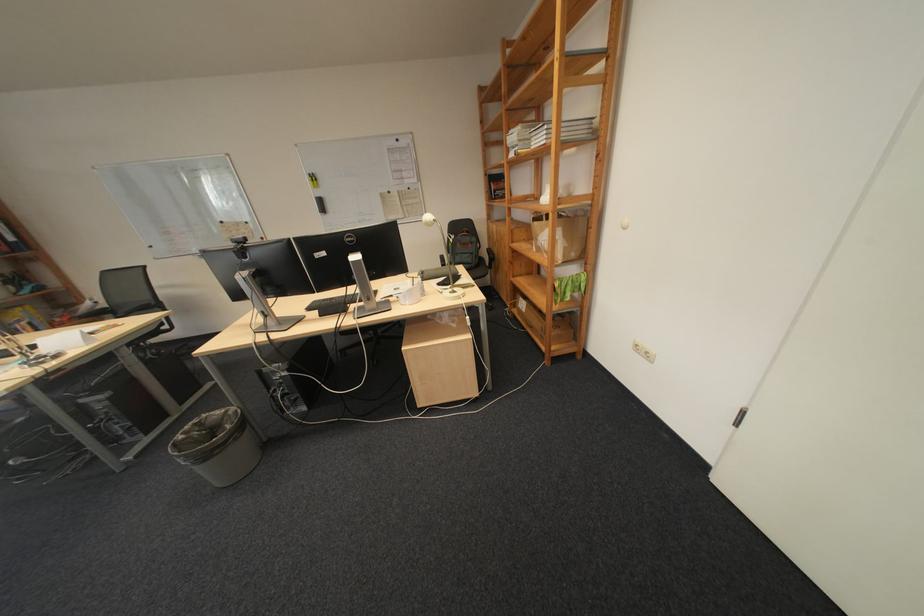
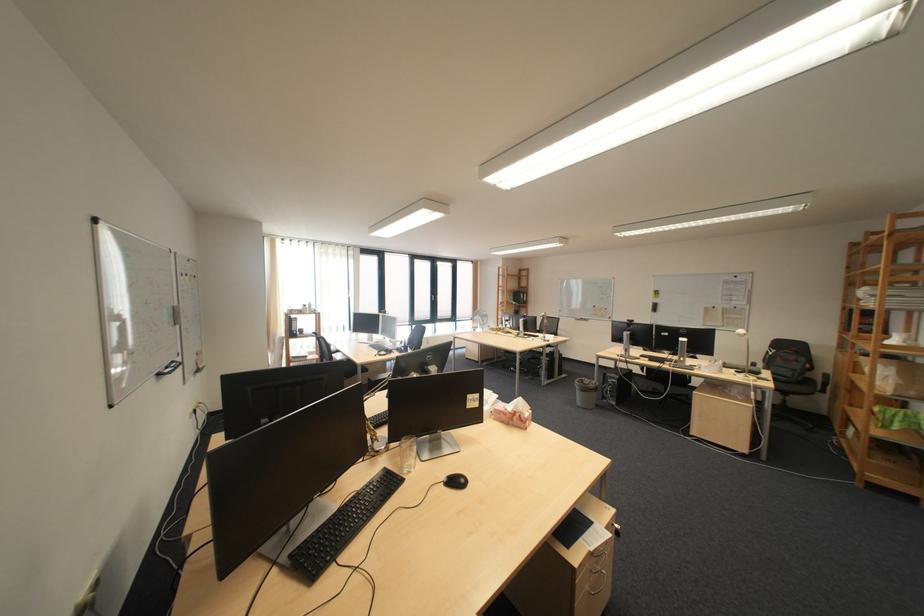
The point at (x=504, y=252) is marked in the first image. Where is the corresponding point in the second image?

(841, 377)